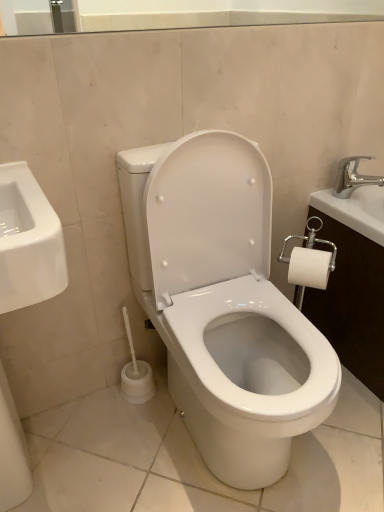
At what (x,y) coordinates should I click in order to perform the action: click on white glossy toilet at center. Please return your answer as a coordinate pair (x, y). The height and width of the screenshot is (512, 384). Looking at the image, I should click on (223, 304).

What do you see at coordinates (223, 304) in the screenshot? I see `white glossy toilet at center` at bounding box center [223, 304].

The height and width of the screenshot is (512, 384). Describe the element at coordinates (352, 177) in the screenshot. I see `silver metallic faucet at upper right` at that location.

Locate an element on the screen. Image resolution: width=384 pixels, height=512 pixels. silver metallic faucet at upper right is located at coordinates (352, 177).

Where is `white glossy toilet at center`? white glossy toilet at center is located at coordinates (223, 304).

Looking at this image, considering the positions of objects silver metallic faucet at upper right and white glossy toilet at center in the image provided, who is more to the right, silver metallic faucet at upper right or white glossy toilet at center?

Positioned to the right is silver metallic faucet at upper right.

Which object is further away from the camera taking this photo, silver metallic faucet at upper right or white glossy toilet at center?

silver metallic faucet at upper right is further from the camera.

Is point (340, 166) in front of point (163, 334)?

No, it is not.

From the image's perspective, is silver metallic faucet at upper right under white glossy toilet at center?

No.

From a real-world perspective, is silver metallic faucet at upper right below white glossy toilet at center?

Incorrect, from a real-world perspective, silver metallic faucet at upper right is higher than white glossy toilet at center.

In terms of width, does silver metallic faucet at upper right look wider or thinner when compared to white glossy toilet at center?

Clearly, silver metallic faucet at upper right has less width compared to white glossy toilet at center.

Can you confirm if silver metallic faucet at upper right is shorter than white glossy toilet at center?

Yes.

Considering the sizes of silver metallic faucet at upper right and white glossy toilet at center in the image, is silver metallic faucet at upper right bigger or smaller than white glossy toilet at center?

Clearly, silver metallic faucet at upper right is smaller in size than white glossy toilet at center.

Would you say silver metallic faucet at upper right is inside or outside white glossy toilet at center?

silver metallic faucet at upper right exists outside the volume of white glossy toilet at center.

Is silver metallic faucet at upper right not close to white glossy toilet at center?

No, there isn't a large distance between silver metallic faucet at upper right and white glossy toilet at center.

Is silver metallic faucet at upper right oriented away from white glossy toilet at center?

silver metallic faucet at upper right does not have its back to white glossy toilet at center.

Can you tell me how much silver metallic faucet at upper right and white glossy toilet at center differ in facing direction?

The angular difference between silver metallic faucet at upper right and white glossy toilet at center is 0.0362 degrees.

Where is `tap on the right side of white glossy toilet at center`? tap on the right side of white glossy toilet at center is located at coordinates (352, 177).

Is white glossy toilet at center to the left of silver metallic faucet at upper right from the viewer's perspective?

Yes, white glossy toilet at center is to the left of silver metallic faucet at upper right.

Between white glossy toilet at center and silver metallic faucet at upper right, which one is positioned in front?

Positioned in front is white glossy toilet at center.

Considering the positions of point (254, 186) and point (370, 179), is point (254, 186) closer or farther from the camera than point (370, 179)?

Clearly, point (254, 186) is closer to the camera than point (370, 179).

From the image's perspective, does white glossy toilet at center appear lower than silver metallic faucet at upper right?

Yes.

From a real-world perspective, is white glossy toilet at center below silver metallic faucet at upper right?

Yes, from a real-world perspective, white glossy toilet at center is under silver metallic faucet at upper right.

In terms of width, does white glossy toilet at center look wider or thinner when compared to silver metallic faucet at upper right?

white glossy toilet at center is wider than silver metallic faucet at upper right.

From their relative heights in the image, would you say white glossy toilet at center is taller or shorter than silver metallic faucet at upper right?

Considering their sizes, white glossy toilet at center has more height than silver metallic faucet at upper right.

Considering the relative sizes of white glossy toilet at center and silver metallic faucet at upper right in the image provided, is white glossy toilet at center bigger than silver metallic faucet at upper right?

Indeed, white glossy toilet at center has a larger size compared to silver metallic faucet at upper right.

Is white glossy toilet at center inside the boundaries of silver metallic faucet at upper right, or outside?

white glossy toilet at center is not enclosed by silver metallic faucet at upper right.

Would you say white glossy toilet at center is a long distance from silver metallic faucet at upper right?

That's not correct — white glossy toilet at center is a little close to silver metallic faucet at upper right.

Is white glossy toilet at center turned away from silver metallic faucet at upper right?

No, white glossy toilet at center is not facing the opposite direction of silver metallic faucet at upper right.

How many degrees apart are the facing directions of white glossy toilet at center and silver metallic faucet at upper right?

The angle between the facing direction of white glossy toilet at center and the facing direction of silver metallic faucet at upper right is 0.0362 degrees.

The image size is (384, 512). In order to click on tap behind the white glossy toilet at center in this screenshot , I will do `click(352, 177)`.

Where is `toilet that is on the left side of silver metallic faucet at upper right`? toilet that is on the left side of silver metallic faucet at upper right is located at coordinates (223, 304).

Locate an element on the screen. The image size is (384, 512). tap behind the white glossy toilet at center is located at coordinates (352, 177).